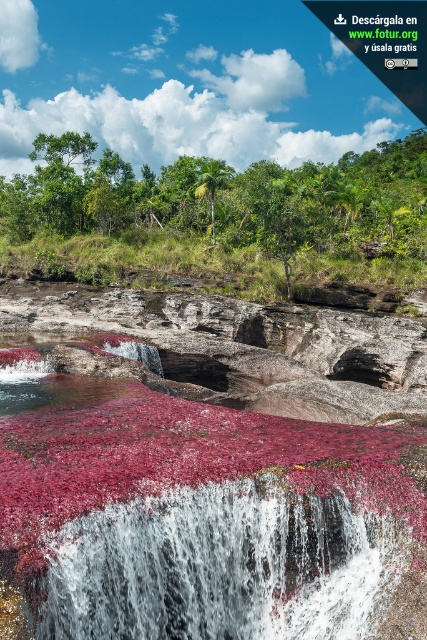
You are a photographer planning to capture the waterfall and its surroundings. You want to ensure that the white frothy water at center and the green leafy trees at center are both visible in your shot. Based on their relative sizes, which object should you focus on to frame the scene appropriately?

The white frothy water at center is thinner than the green leafy trees at center, so you should focus on the green leafy trees at center to frame the scene appropriately since they are wider and more prominent in the composition.

You are standing at the edge of the waterfall and see the white frothy water at center and the green leafy trees at center. Which object is nearer to you?

The white frothy water at center is closer to the viewer than the green leafy trees at center.

You are standing at the edge of the waterfall and see the white frothy water at center and the green leafy trees at center. Which object is positioned to the left when looking towards the waterfall?

The white frothy water at center is positioned to the left of the green leafy trees at center.